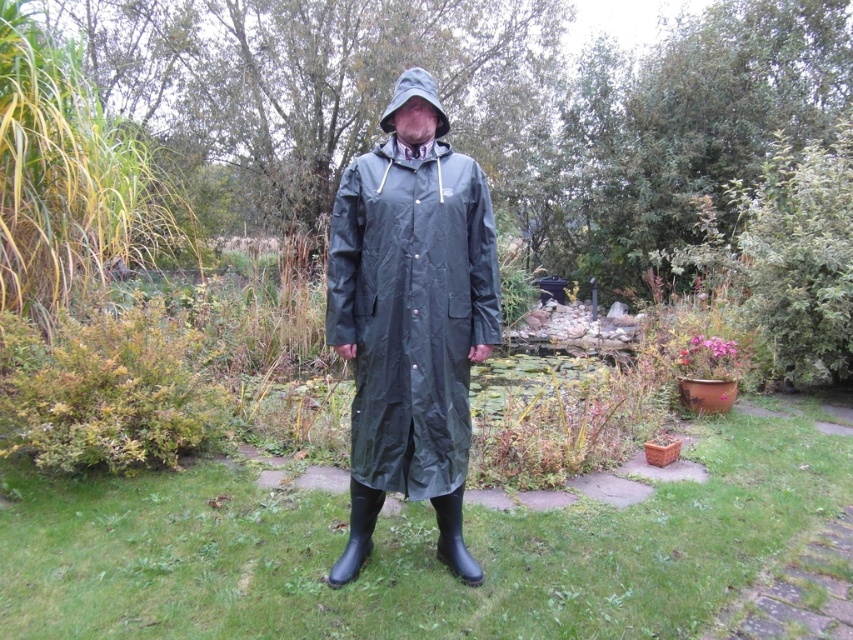
Question: Is matte black raincoat at center above rubber boot at lower center?

Choices:
 (A) yes
 (B) no

Answer: (A)

Question: Which object is farther from the camera taking this photo?

Choices:
 (A) matte black raincoat at center
 (B) rubber boots at lower center
 (C) rubber boot at lower center
 (D) matte gray hood at center

Answer: (B)

Question: Does rubber boot at lower center appear on the right side of matte gray hood at center?

Choices:
 (A) yes
 (B) no

Answer: (A)

Question: Among these objects, which one is nearest to the camera?

Choices:
 (A) rubber boot at lower center
 (B) matte black raincoat at center

Answer: (B)

Question: Observing the image, what is the correct spatial positioning of rubber boots at lower center in reference to rubber boot at lower center?

Choices:
 (A) left
 (B) right

Answer: (A)

Question: Which point is closer to the camera?

Choices:
 (A) rubber boot at lower center
 (B) matte gray hood at center

Answer: (B)